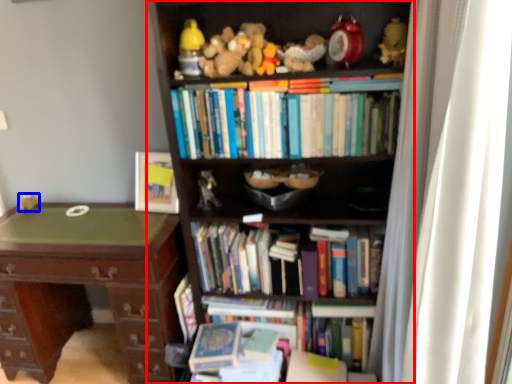
Question: Among these objects, which one is farthest to the camera, bookcase (highlighted by a red box) or toy (highlighted by a blue box)?

Choices:
 (A) bookcase
 (B) toy

Answer: (B)